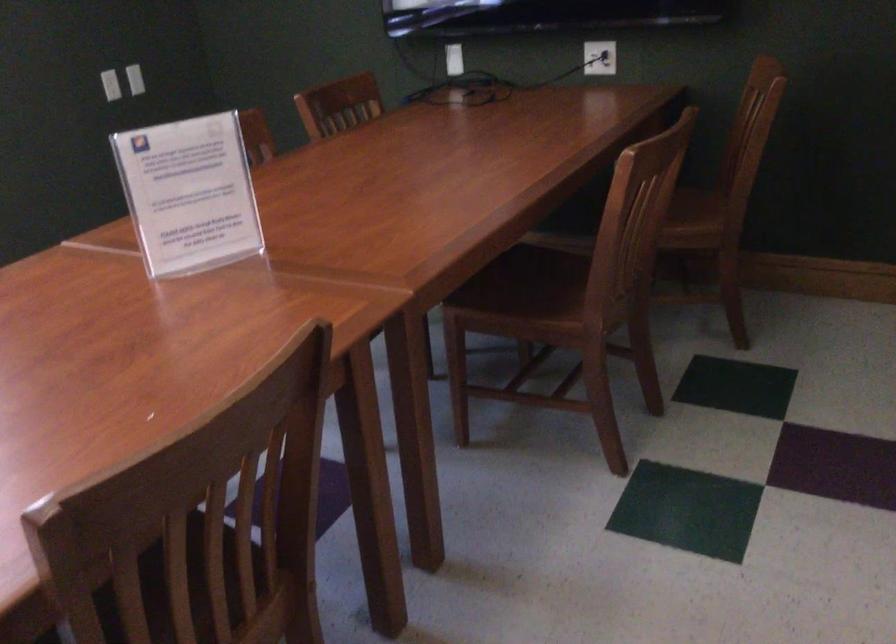
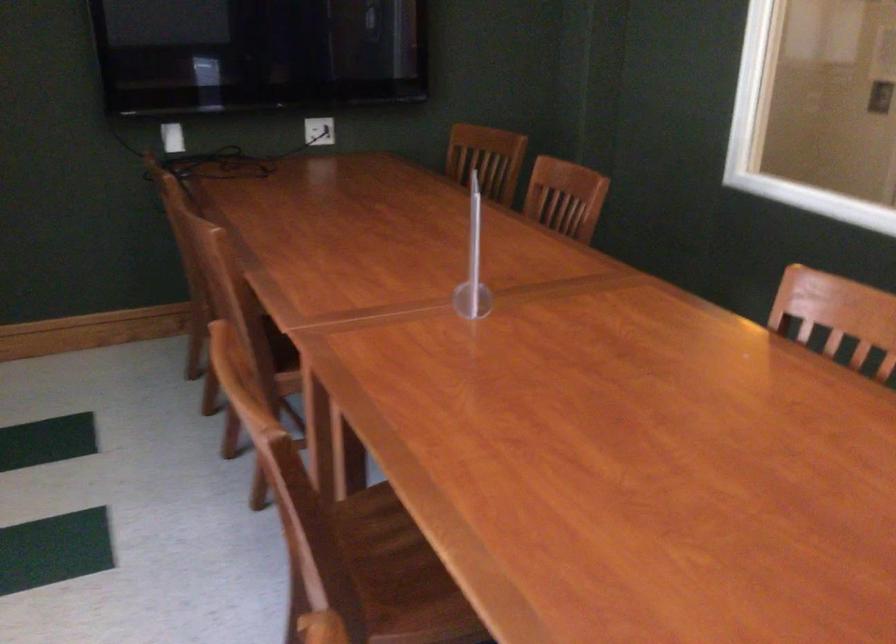
Locate, in the second image, the point that corresponds to point (273, 420) in the first image.

(841, 313)